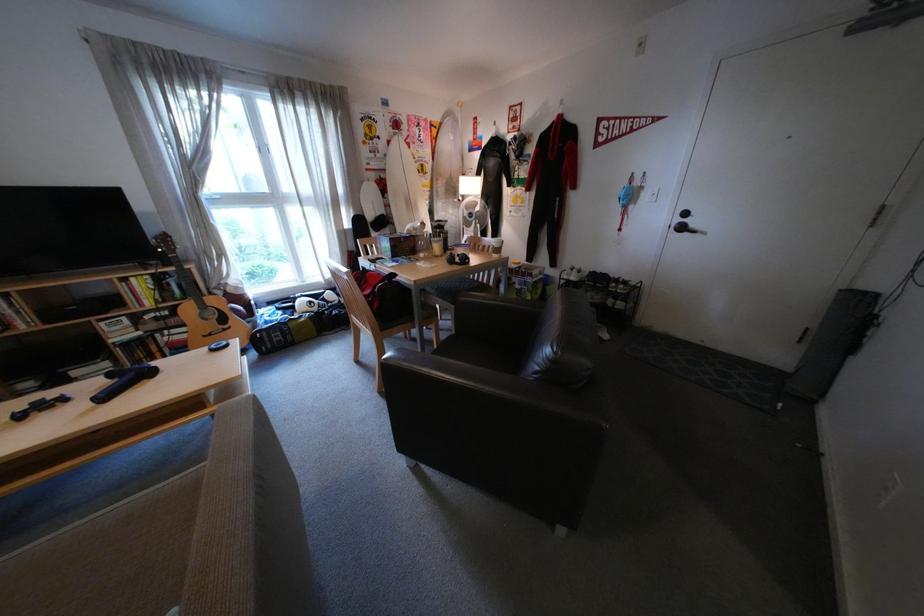
Where would you flip the white light switch? Please return your answer as a coordinate pair (x, y).

(640, 45)